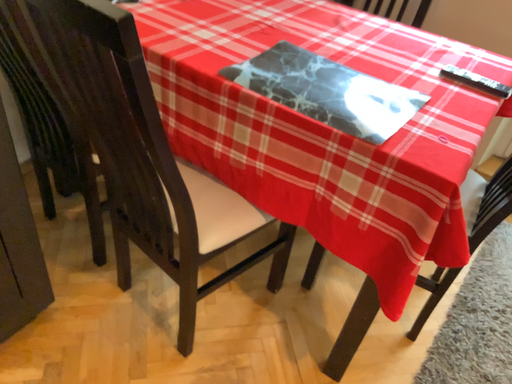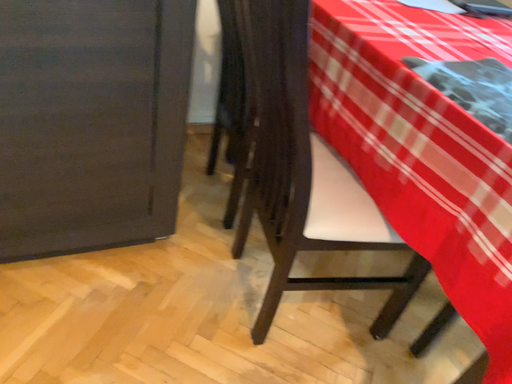
Question: Which way did the camera rotate in the video?

Choices:
 (A) rotated upward
 (B) rotated downward

Answer: (A)